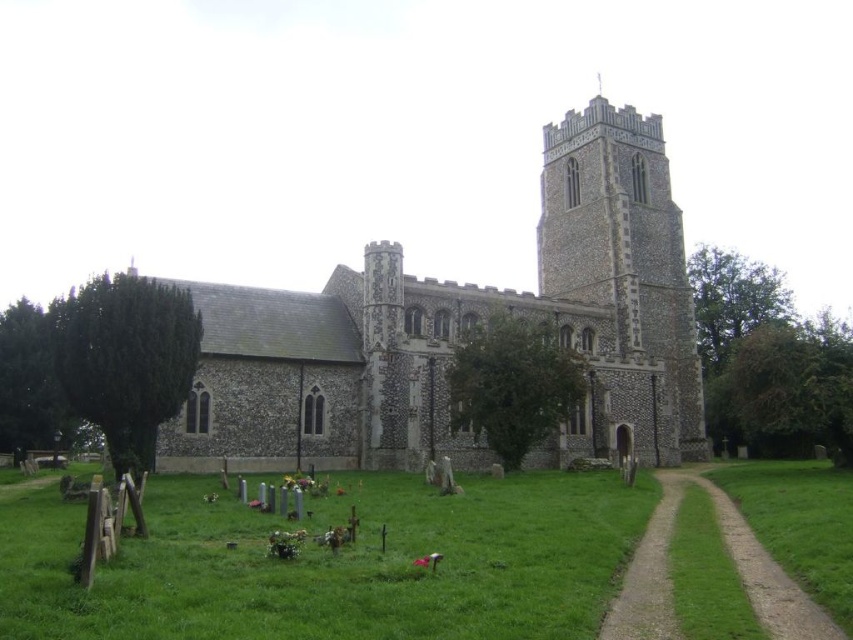
Question: Considering the real-world distances, which object is closest to the stone church at center?

Choices:
 (A) green grassy path at lower right
 (B) stone tower at center

Answer: (B)

Question: Does stone tower at center appear under green grassy path at lower right?

Choices:
 (A) yes
 (B) no

Answer: (B)

Question: Among these objects, which one is nearest to the camera?

Choices:
 (A) green grassy path at lower right
 (B) stone tower at center

Answer: (A)

Question: Is stone tower at center closer to the viewer compared to green grassy path at lower right?

Choices:
 (A) yes
 (B) no

Answer: (B)

Question: Does stone church at center appear over stone tower at center?

Choices:
 (A) no
 (B) yes

Answer: (A)

Question: Among these objects, which one is nearest to the camera?

Choices:
 (A) green grassy path at lower right
 (B) stone church at center
 (C) stone tower at center

Answer: (A)